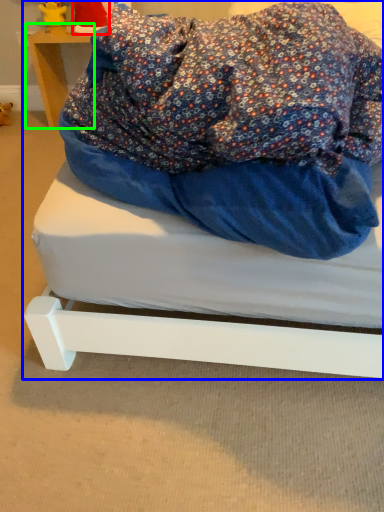
Question: Estimate the real-world distances between objects in this image. Which object is farther from toy (highlighted by a red box), bed (highlighted by a blue box) or furniture (highlighted by a green box)?

Choices:
 (A) bed
 (B) furniture

Answer: (A)